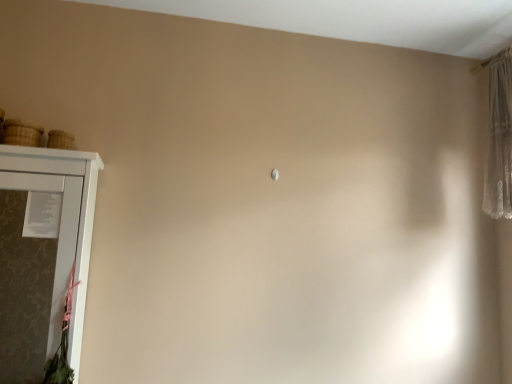
Question: Considering the positions of white matte cupboard at left and brown woven basket at left, arranged as the 1th basket when viewed from the left, in the image, is white matte cupboard at left bigger or smaller than brown woven basket at left, arranged as the 1th basket when viewed from the left,?

Choices:
 (A) big
 (B) small

Answer: (A)

Question: From the image's perspective, relative to brown woven basket at left, the second basket from the right, is white matte cupboard at left above or below?

Choices:
 (A) below
 (B) above

Answer: (A)

Question: Considering the real-world distances, which object is closest to the woven straw basket at upper left, placed as the second basket when sorted from left to right?

Choices:
 (A) white matte cupboard at left
 (B) brown woven basket at left, arranged as the 1th basket when viewed from the left

Answer: (B)

Question: Which object is the closest to the brown woven basket at left, the second basket from the right?

Choices:
 (A) white matte cupboard at left
 (B) woven straw basket at upper left, which appears as the 1th basket when viewed from the right

Answer: (B)